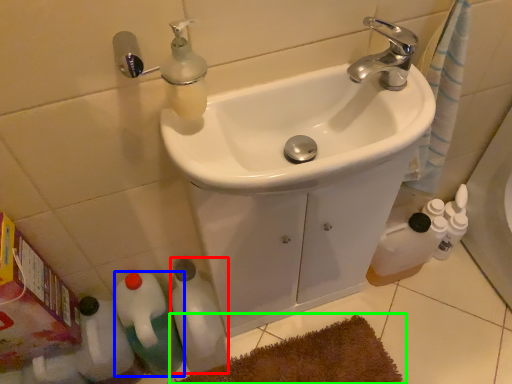
Question: Estimate the real-world distances between objects in this image. Which object is closer to bottle (highlighted by a red box), bottle (highlighted by a blue box) or bath mat (highlighted by a green box)?

Choices:
 (A) bottle
 (B) bath mat

Answer: (A)